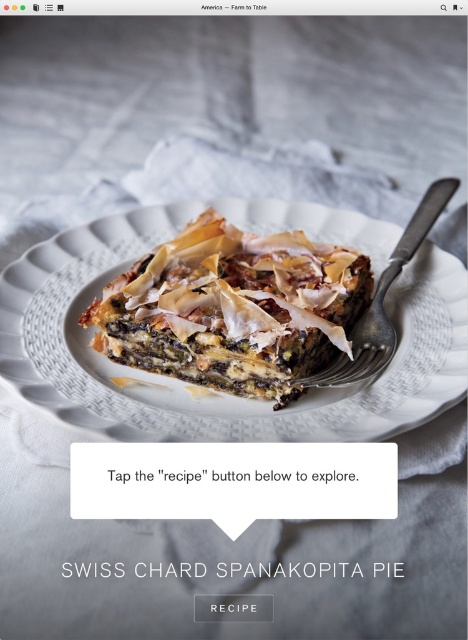
Looking at this image, which of these two, golden-brown phyllo pastry at center or silver metallic fork at center-right, stands taller?

With more height is silver metallic fork at center-right.

Does point (156, 365) lie in front of point (415, 214)?

Yes, it is in front of point (415, 214).

Locate an element on the screen. golden-brown phyllo pastry at center is located at coordinates (233, 308).

The width and height of the screenshot is (468, 640). Find the location of `golden-brown phyllo pastry at center`. golden-brown phyllo pastry at center is located at coordinates (233, 308).

Does point (270, 573) come behind point (204, 468)?

No, it is in front of (204, 468).

Can you confirm if white paper text at center is thinner than white matte button at center?

In fact, white paper text at center might be wider than white matte button at center.

Is point (102, 564) less distant than point (315, 474)?

Yes, it is.

The image size is (468, 640). In order to click on white paper text at center in this screenshot , I will do `click(93, 570)`.

Looking at this image, does golden-brown phyllo pastry at center have a larger size compared to white matte button at center?

Correct, golden-brown phyllo pastry at center is larger in size than white matte button at center.

Looking at this image, does golden-brown phyllo pastry at center appear under white matte button at center?

No, golden-brown phyllo pastry at center is not below white matte button at center.

This screenshot has width=468, height=640. Find the location of `golden-brown phyllo pastry at center`. golden-brown phyllo pastry at center is located at coordinates (233, 308).

I want to click on golden-brown phyllo pastry at center, so click(233, 308).